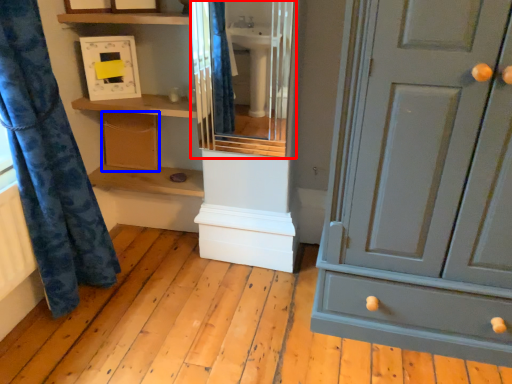
Question: Which of the following is the closest to the observer, cabinet (highlighted by a red box) or cabinetry (highlighted by a blue box)?

Choices:
 (A) cabinet
 (B) cabinetry

Answer: (A)